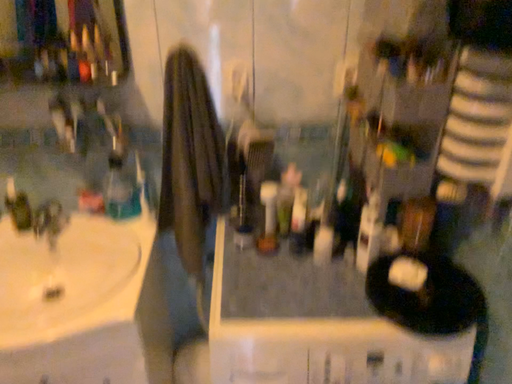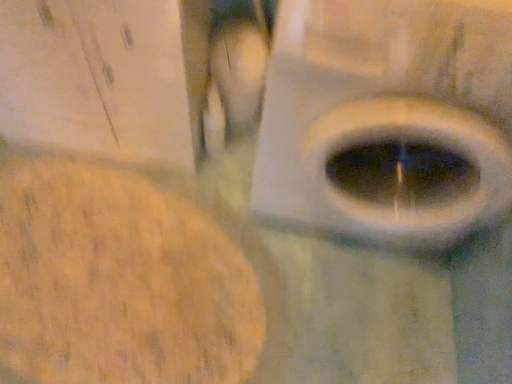
Question: Which way did the camera rotate in the video?

Choices:
 (A) rotated left
 (B) rotated right

Answer: (A)